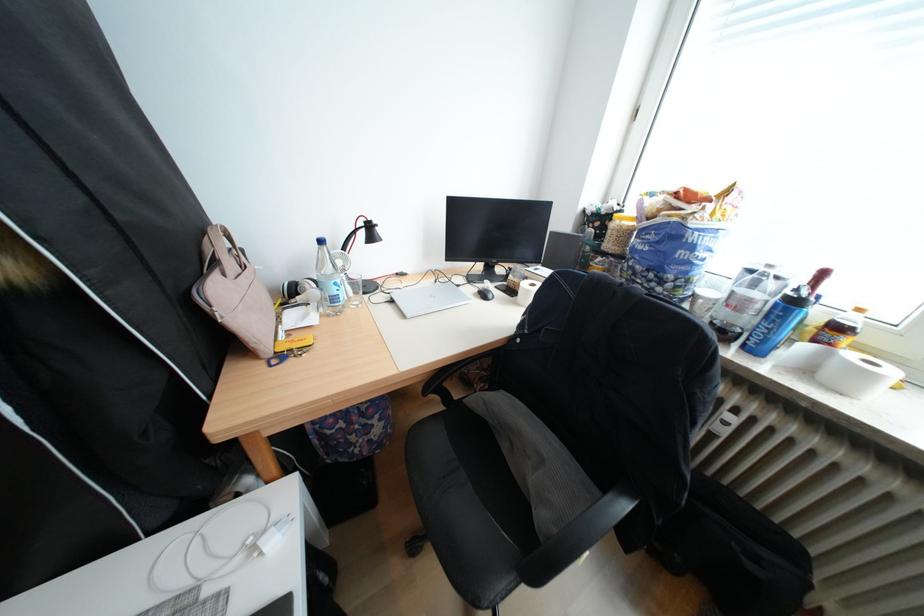
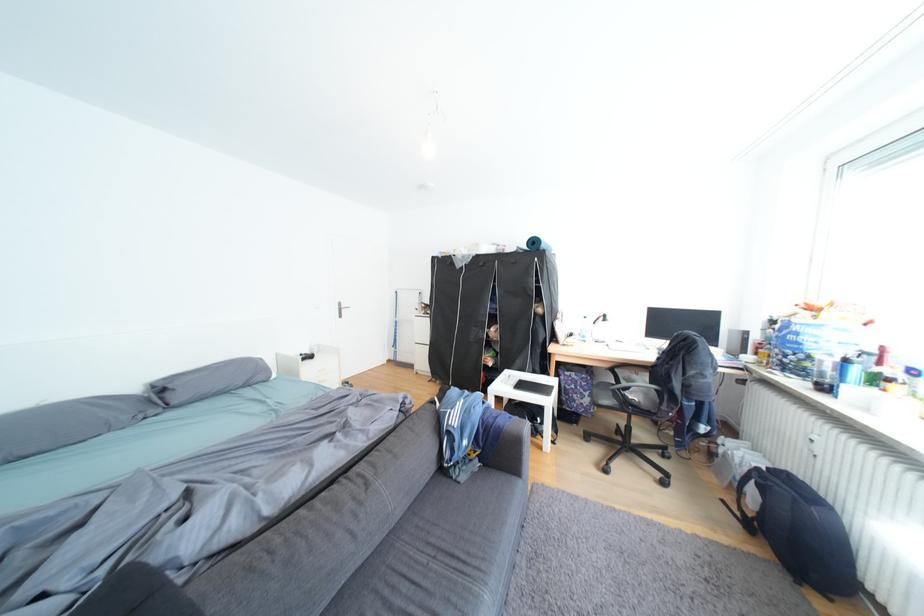
Question: I am providing you with two images of the same scene from different viewpoints. Which of the following objects are not visible in image2?

Choices:
 (A) black chair sitting surface
 (B) square glass bottle
 (C) silver laptop
 (D) silver door handle

Answer: (C)